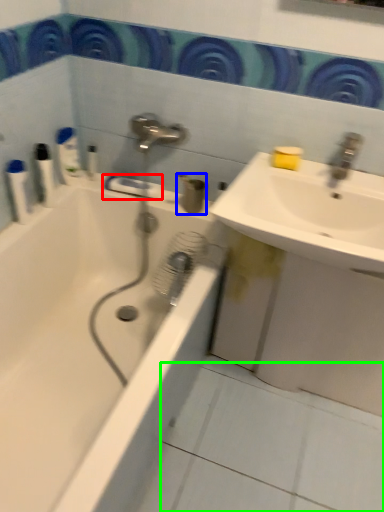
Question: Which object is the closest to the towel bar (highlighted by a red box)? Choose among these: toiletry (highlighted by a blue box) or ceramic tile (highlighted by a green box).

Choices:
 (A) toiletry
 (B) ceramic tile

Answer: (A)